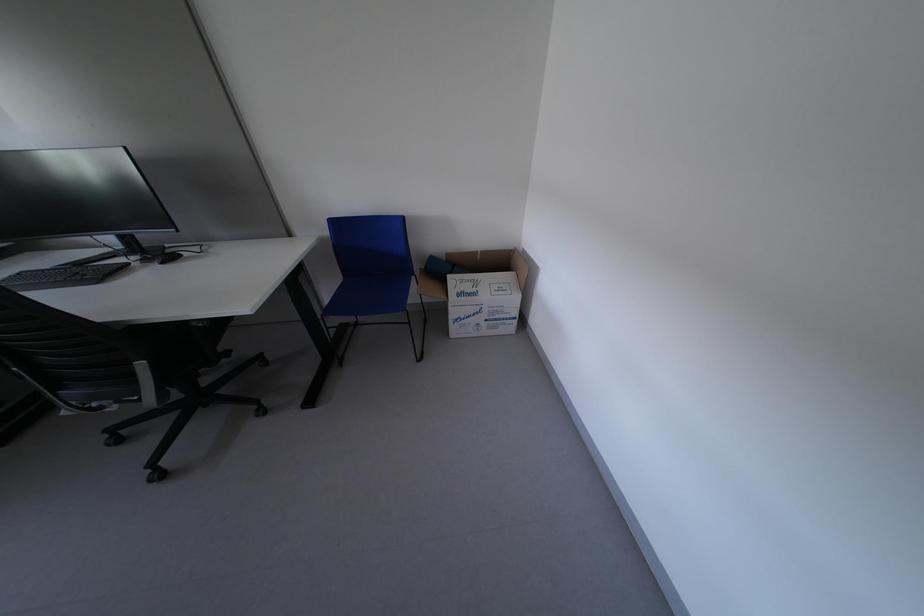
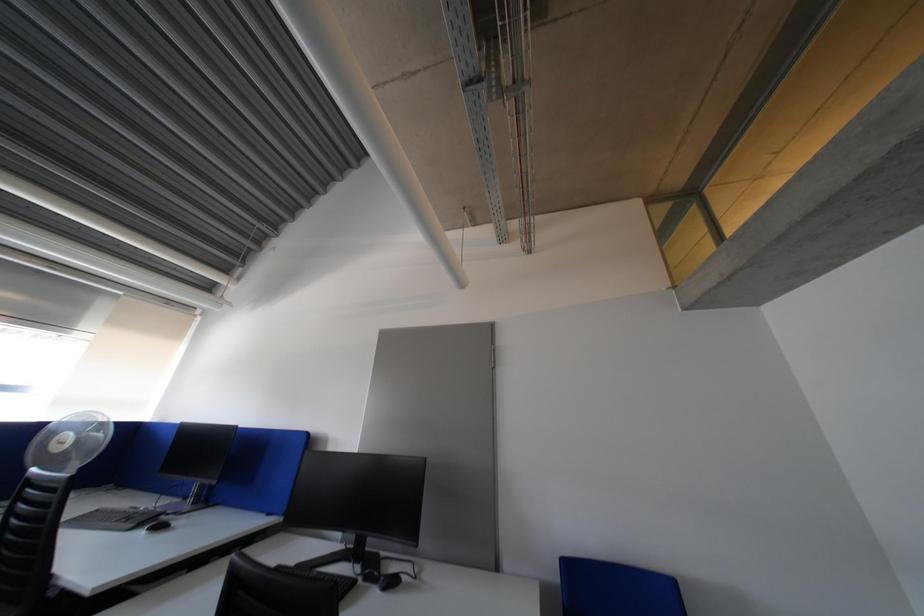
How did the camera likely rotate?

The rotation direction of the camera is left-up.